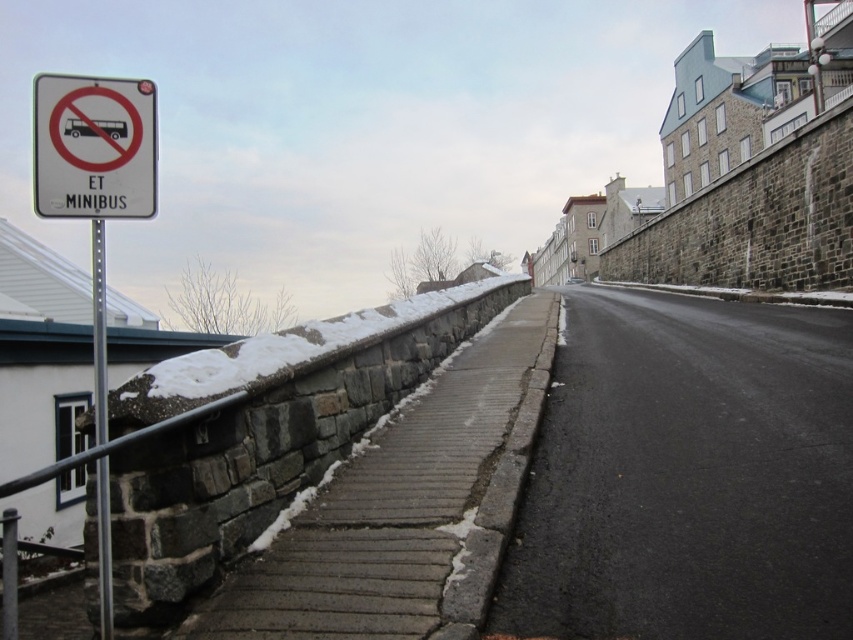
You are a delivery person carrying a large package and need to navigate through the street scene. There is a white plastic sign at upper left and a camera somewhere in the scene. If you want to avoid both, which direction should you move to? Please consider the distance between them.

The white plastic sign at upper left and the camera are 3.25 meters apart. To avoid both, you should move in a direction that keeps you at least 3.25 meters away from the area between them, ensuring you stay clear of both objects.

You are a pedestrian walking on the snowy sidewalk and see the white plastic sign at upper left and the metallic pole at left. Which object is bigger in size?

The white plastic sign at upper left is larger in size than the metallic pole at left.

You are standing on the sidewalk in the historic urban area and want to walk from point A to point B. Point A is at coordinate (54, 184) and point B is at coordinate (102, 592). Since you want to avoid the snow on the low stone wall along the way, which direction should you walk to stay on the safe path?

You should walk towards the direction away from the viewer because point A is closer to you than point B, so moving towards B would take you further away from the wall with snow.